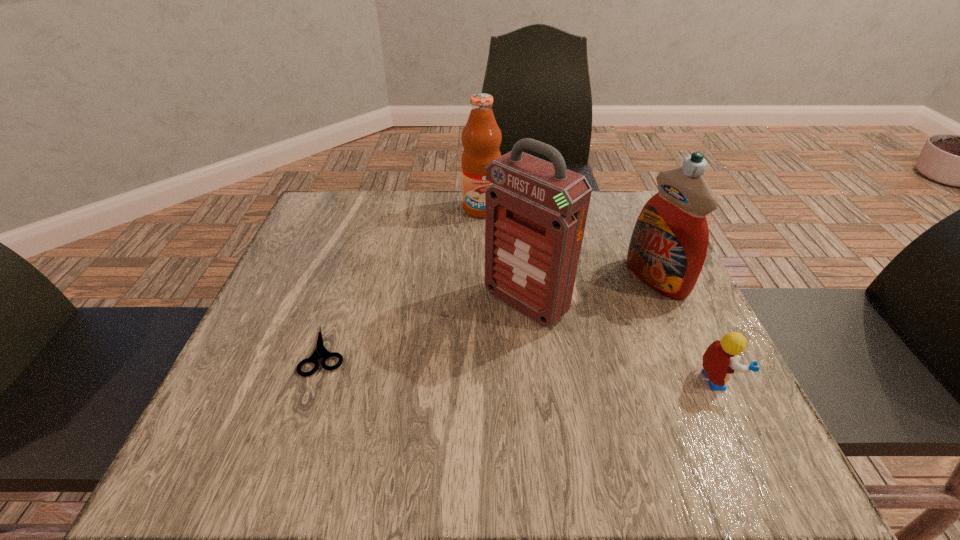
Identify the location of free region that satisfies the following two spatial constraints: 1. on the front side of the second shortest object; 2. on the front-facing side of the shears. tap(316, 380).